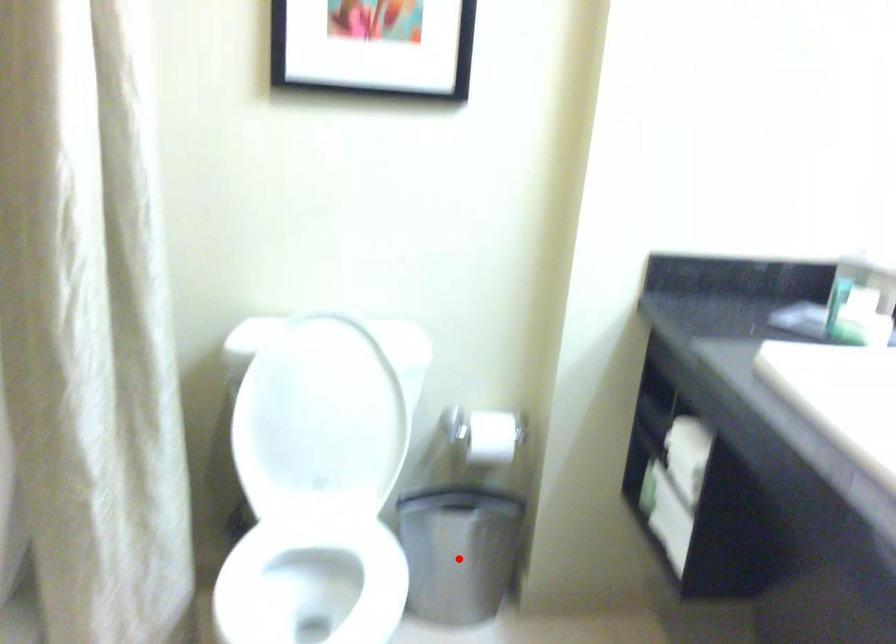
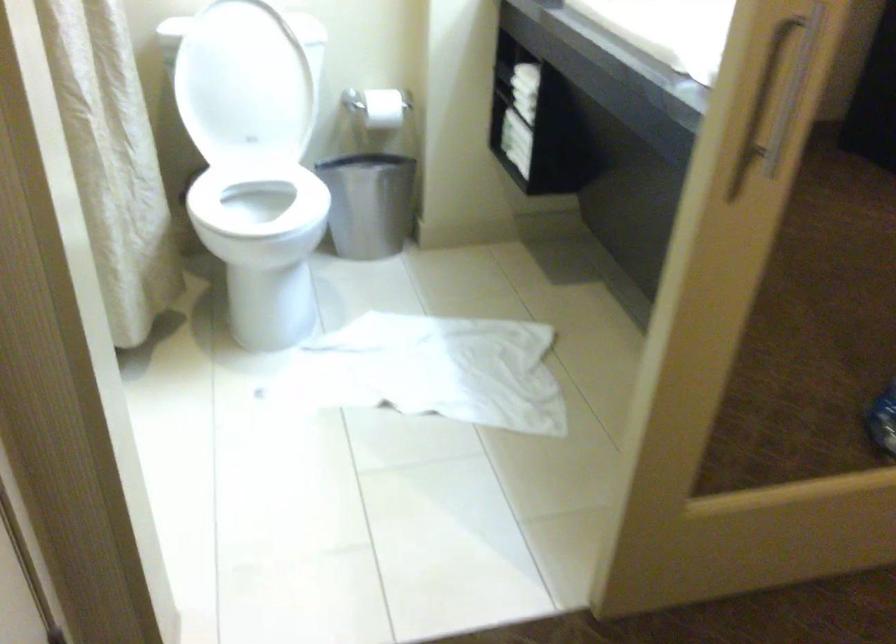
Question: I am providing you with two images of the same scene from different viewpoints. Given a red point in image1, look at the same physical point in image2. Is it:

Choices:
 (A) Closer to the viewpoint
 (B) Farther from the viewpoint

Answer: (B)